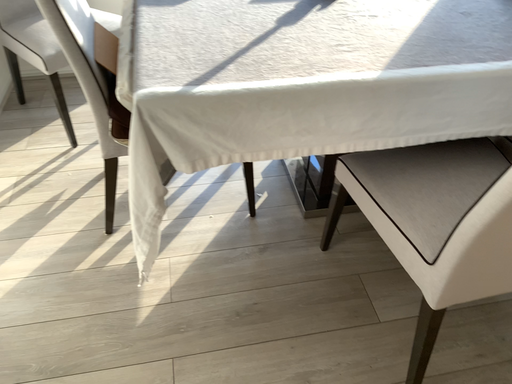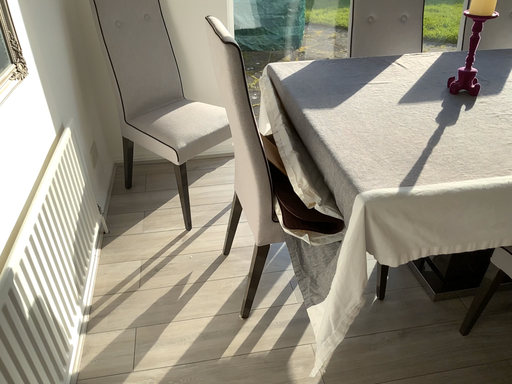
Question: How did the camera likely rotate when shooting the video?

Choices:
 (A) rotated upward
 (B) rotated downward

Answer: (A)